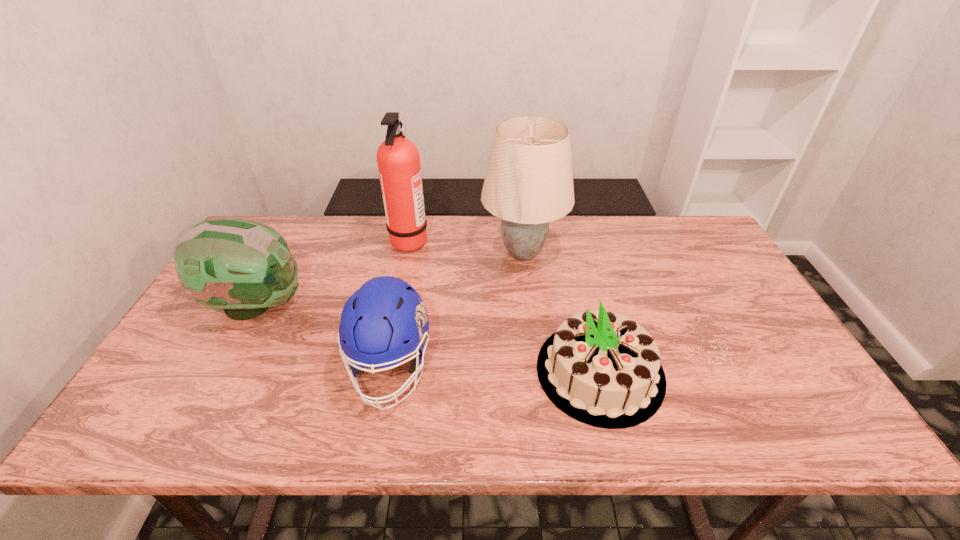
Where is `fire extinguisher`? The height and width of the screenshot is (540, 960). fire extinguisher is located at coordinates (398, 159).

At what (x,y) coordinates should I click in order to perform the action: click on lampshade. Please return your answer as a coordinate pair (x, y). The height and width of the screenshot is (540, 960). Looking at the image, I should click on coord(529,182).

You are a GUI agent. You are given a task and a screenshot of the screen. Output one action in this format:
    pyautogui.click(x=<x>, y=<y>)
    Task: Click on the left football helmet
    
    Given the screenshot: What is the action you would take?
    pyautogui.click(x=244, y=267)

Locate an element on the screen. the right football helmet is located at coordinates (385, 321).

This screenshot has width=960, height=540. In order to click on the shortest object in this screenshot , I will do `click(603, 369)`.

The width and height of the screenshot is (960, 540). I want to click on vacant space situated 0.110m on the handle side of the fire extinguisher, so click(x=463, y=240).

What are the coordinates of `free spot located 0.270m on the front of the lampshade` in the screenshot? It's located at (535, 353).

Image resolution: width=960 pixels, height=540 pixels. I want to click on vacant space situated 0.240m on the visor of the leftmost object, so click(393, 305).

Locate an element on the screen. Image resolution: width=960 pixels, height=540 pixels. vacant area situated on the right of the shortest object is located at coordinates (793, 372).

Find the location of `fire extinguisher present at the far edge`. fire extinguisher present at the far edge is located at coordinates (398, 159).